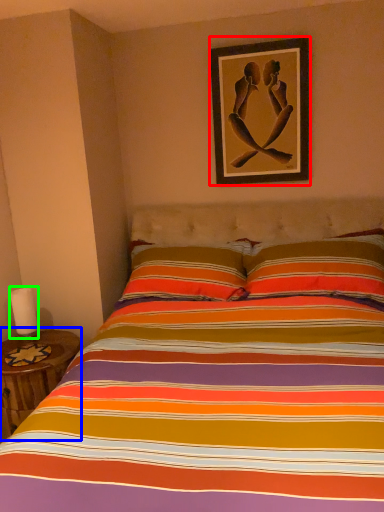
Question: Which is nearer to the picture frame (highlighted by a red box)? table (highlighted by a blue box) or candle (highlighted by a green box).

Choices:
 (A) table
 (B) candle

Answer: (A)